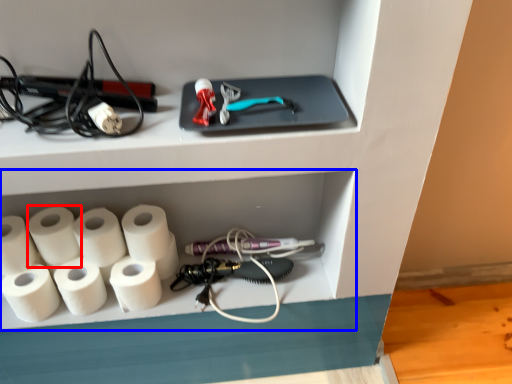
Question: Among these objects, which one is farthest to the camera, paper towel (highlighted by a red box) or shelf (highlighted by a blue box)?

Choices:
 (A) paper towel
 (B) shelf

Answer: (B)